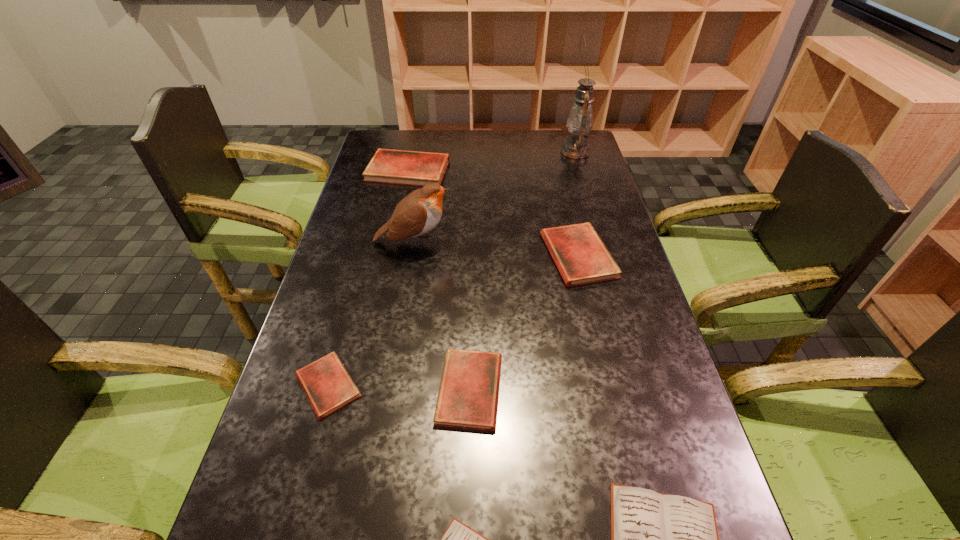
This screenshot has width=960, height=540. Find the location of `object that is at the far left corner`. object that is at the far left corner is located at coordinates (415, 168).

This screenshot has width=960, height=540. What are the coordinates of `object present at the far right corner` in the screenshot? It's located at (580, 120).

In the image, there is a desktop. At what (x,y) coordinates should I click in order to perform the action: click on vacant area at the far edge. Please return your answer as a coordinate pair (x, y). Looking at the image, I should click on [x=459, y=155].

This screenshot has width=960, height=540. What are the coordinates of `free space at the left edge of the desktop` in the screenshot? It's located at (333, 271).

Locate an element on the screen. The height and width of the screenshot is (540, 960). vacant space at the right edge of the desktop is located at coordinates (677, 446).

Where is `free space between the second tallest diary and the second smallest red diary`? The height and width of the screenshot is (540, 960). free space between the second tallest diary and the second smallest red diary is located at coordinates (524, 322).

What are the coordinates of `vacant space that is in between the smallest red diary and the biggest red diary` in the screenshot? It's located at (368, 278).

Where is `the third closest object to the tallest object`? the third closest object to the tallest object is located at coordinates (418, 213).

This screenshot has height=540, width=960. I want to click on object that is the fifth closest to the third smallest red diary, so tap(328, 386).

Identify which diary is the fourth nearest to the farthest diary. Please provide its 2D coordinates. Your answer should be formatted as a tuple, i.e. [(x, y)], where the tuple contains the x and y coordinates of a point satisfying the conditions above.

[(657, 539)]